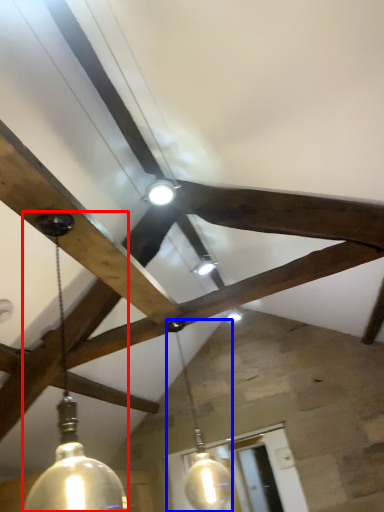
Question: Which of the following is the farthest to the observer, lamp (highlighted by a red box) or lamp (highlighted by a blue box)?

Choices:
 (A) lamp
 (B) lamp

Answer: (B)